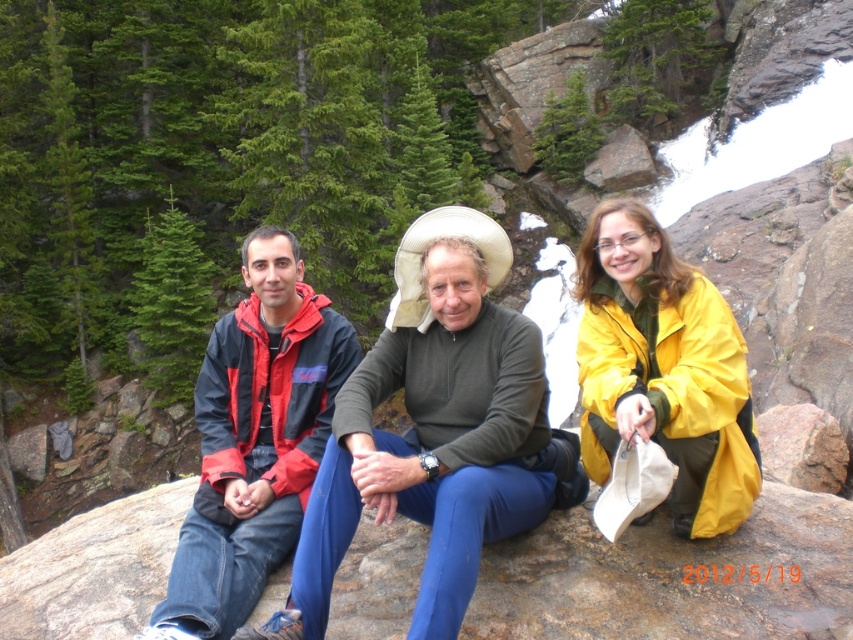
You are planning to place a 10 feet long tent between the smooth granite boulder at center and the red jacket at center. Is there enough space for the tent?

The smooth granite boulder at center is 9.30 feet from the red jacket at center. Since the tent is 10 feet long, there isn not enough space to place it between them.

You are planning to climb the smooth granite boulder at center. Considering the height of the red jacket at center, do you think the boulder is taller than the jacket?

The smooth granite boulder at center has a lesser height compared to the red jacket at center, so the boulder is shorter than the jacket. Therefore, it should be manageable to climb.

You are standing at the edge of a cliff overlooking the scene. You want to throw a small stone to hit the smooth granite boulder at center. If your throwing range is 23 feet, will you be able to reach it?

The smooth granite boulder at center is 23.34 feet away from the viewer, which is slightly beyond your throwing range of 23 feet. Therefore, you won